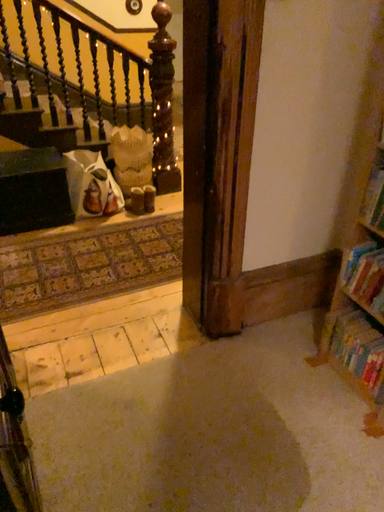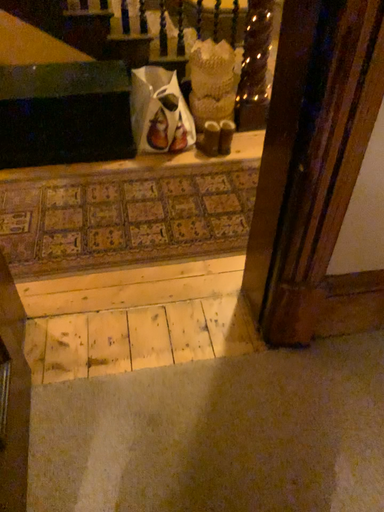
Question: Which way did the camera rotate in the video?

Choices:
 (A) rotated right
 (B) rotated left

Answer: (B)